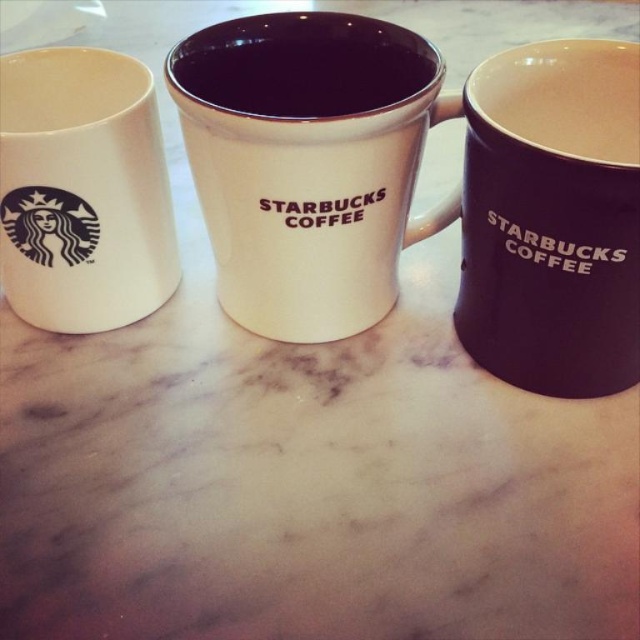
Question: Which of the following is the closest to the observer?

Choices:
 (A) (284, 56)
 (B) (595, 339)
 (C) (378, 268)
 (D) (140, 84)

Answer: (B)

Question: Can you confirm if matte black mug at right is positioned to the right of matte ceramic mug at left?

Choices:
 (A) yes
 (B) no

Answer: (A)

Question: Which of the following is the farthest from the observer?

Choices:
 (A) matte ceramic mug at left
 (B) white glossy mug at center
 (C) matte black mug at right

Answer: (A)

Question: Can you confirm if white glossy mug at center is positioned above matte ceramic mug at center?

Choices:
 (A) yes
 (B) no

Answer: (B)

Question: Is white glossy mug at center above matte black mug at right?

Choices:
 (A) yes
 (B) no

Answer: (A)

Question: Estimate the real-world distances between objects in this image. Which object is farther from the white glossy mug at center?

Choices:
 (A) matte black mug at right
 (B) matte ceramic mug at left
 (C) matte ceramic mug at center

Answer: (A)